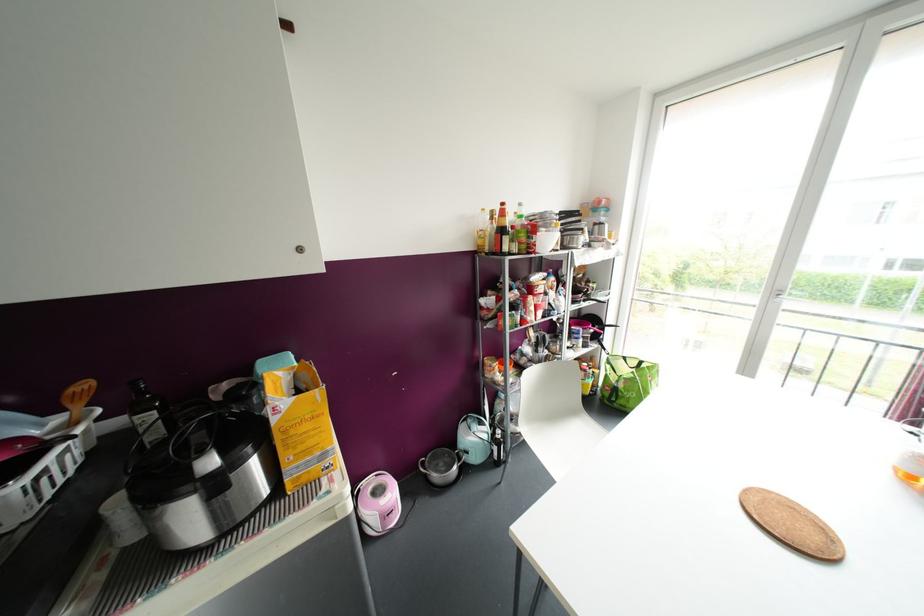
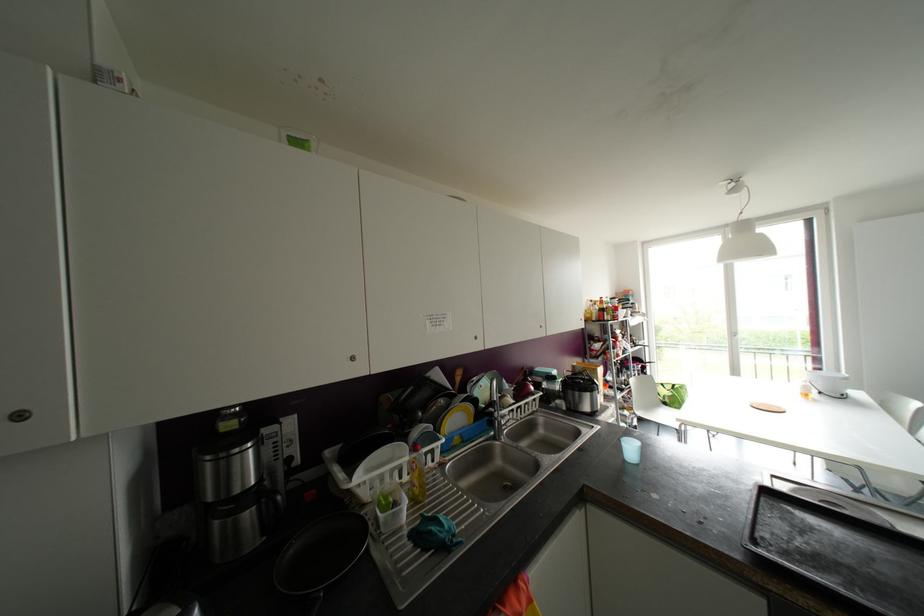
In a continuous first-person perspective shot, in which direction is the camera moving?

The cameraman walked toward left, backward.